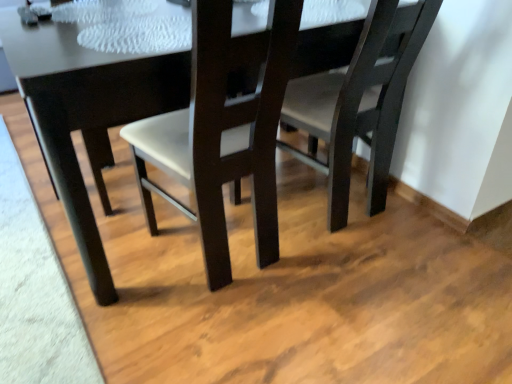
Identify the location of free spot in front of matte dark wood chair at center, which is counted as the second chair, starting from the left. The width and height of the screenshot is (512, 384). (x=368, y=282).